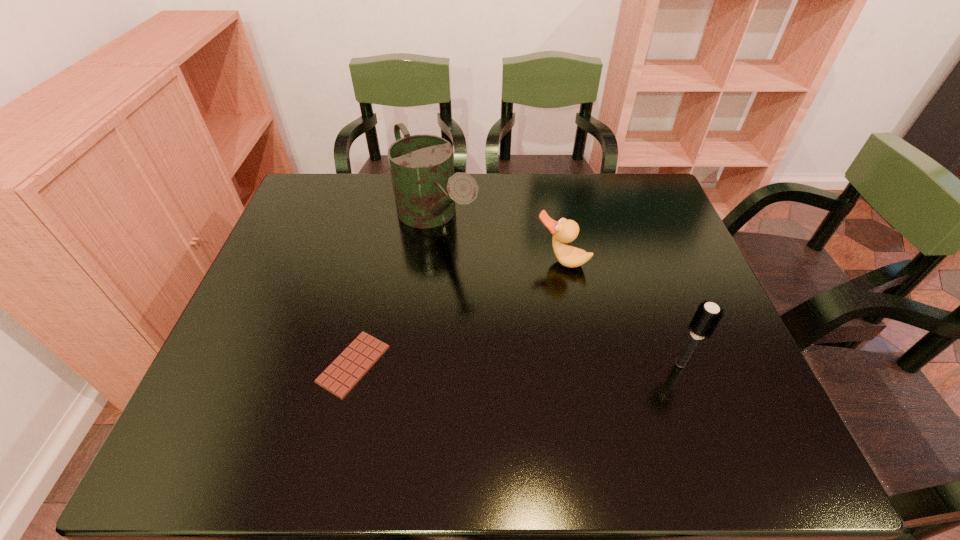
Where is `vacant space at the right edge of the desktop`? vacant space at the right edge of the desktop is located at coordinates (678, 275).

The image size is (960, 540). Find the location of `vacant point at the far left corner`. vacant point at the far left corner is located at coordinates (299, 207).

I want to click on vacant space at the far right corner of the desktop, so click(x=649, y=200).

Image resolution: width=960 pixels, height=540 pixels. Find the location of `vacant point located between the candy bar and the rightmost object`. vacant point located between the candy bar and the rightmost object is located at coordinates (517, 364).

Identify the location of free space between the third tallest object and the candy bar. (457, 313).

You are a GUI agent. You are given a task and a screenshot of the screen. Output one action in this format:
    pyautogui.click(x=<x>, y=<y>)
    Task: Click on the empty space between the candy bar and the rightmost object
    
    Given the screenshot: What is the action you would take?
    pyautogui.click(x=517, y=364)

The height and width of the screenshot is (540, 960). What are the coordinates of `vacant space in between the shortest object and the watering can` in the screenshot? It's located at (395, 292).

Find the location of a particular element. This screenshot has width=960, height=540. empty location between the tallest object and the duck is located at coordinates (499, 240).

Locate an element on the screen. The height and width of the screenshot is (540, 960). free space between the watering can and the candy bar is located at coordinates (395, 292).

Identify the location of free area in between the shortest object and the watering can. The image size is (960, 540). (395, 292).